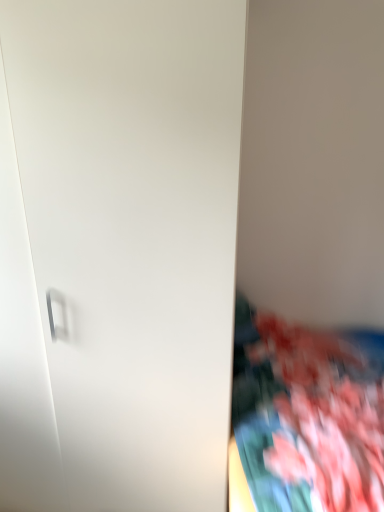
Question: From the image's perspective, is floral fabric at right positioned above or below white matte door at center?

Choices:
 (A) above
 (B) below

Answer: (B)

Question: From a real-world perspective, is floral fabric at right above or below white matte door at center?

Choices:
 (A) below
 (B) above

Answer: (A)

Question: Do you think floral fabric at right is within white matte door at center, or outside of it?

Choices:
 (A) inside
 (B) outside

Answer: (B)

Question: Is white matte door at center inside the boundaries of floral fabric at right, or outside?

Choices:
 (A) outside
 (B) inside

Answer: (A)

Question: From the image's perspective, is white matte door at center located above or below floral fabric at right?

Choices:
 (A) below
 (B) above

Answer: (B)

Question: Looking at their shapes, would you say white matte door at center is wider or thinner than floral fabric at right?

Choices:
 (A) wide
 (B) thin

Answer: (B)

Question: Relative to floral fabric at right, is white matte door at center in front or behind?

Choices:
 (A) behind
 (B) front

Answer: (A)